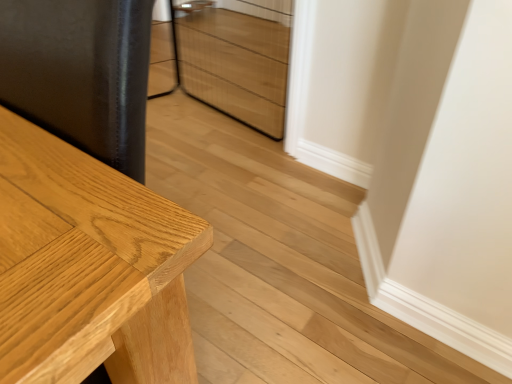
Question: Should I look upward or downward to see light brown wood table at left?

Choices:
 (A) up
 (B) down

Answer: (B)

Question: Can you confirm if light brown wood table at left is taller than wooden drawer at center?

Choices:
 (A) no
 (B) yes

Answer: (B)

Question: Can you confirm if light brown wood table at left is positioned to the right of wooden drawer at center?

Choices:
 (A) yes
 (B) no

Answer: (B)

Question: Considering the relative sizes of light brown wood table at left and wooden drawer at center in the image provided, is light brown wood table at left bigger than wooden drawer at center?

Choices:
 (A) yes
 (B) no

Answer: (A)

Question: Does light brown wood table at left lie in front of wooden drawer at center?

Choices:
 (A) no
 (B) yes

Answer: (B)

Question: Would you consider light brown wood table at left to be distant from wooden drawer at center?

Choices:
 (A) no
 (B) yes

Answer: (B)

Question: Is wooden drawer at center a part of light brown wood table at left?

Choices:
 (A) yes
 (B) no

Answer: (B)

Question: Is wooden drawer at center at the right side of light brown wood table at left?

Choices:
 (A) no
 (B) yes

Answer: (B)

Question: From a real-world perspective, does wooden drawer at center sit lower than light brown wood table at left?

Choices:
 (A) yes
 (B) no

Answer: (A)

Question: Does wooden drawer at center appear on the left side of light brown wood table at left?

Choices:
 (A) no
 (B) yes

Answer: (A)

Question: Is wooden drawer at center positioned beyond the bounds of light brown wood table at left?

Choices:
 (A) yes
 (B) no

Answer: (A)

Question: From a real-world perspective, is wooden drawer at center on top of light brown wood table at left?

Choices:
 (A) yes
 (B) no

Answer: (B)

Question: Considering the relative sizes of wooden drawer at center and light brown wood table at left in the image provided, is wooden drawer at center shorter than light brown wood table at left?

Choices:
 (A) no
 (B) yes

Answer: (B)

Question: In terms of size, does light brown wood table at left appear bigger or smaller than wooden drawer at center?

Choices:
 (A) small
 (B) big

Answer: (B)